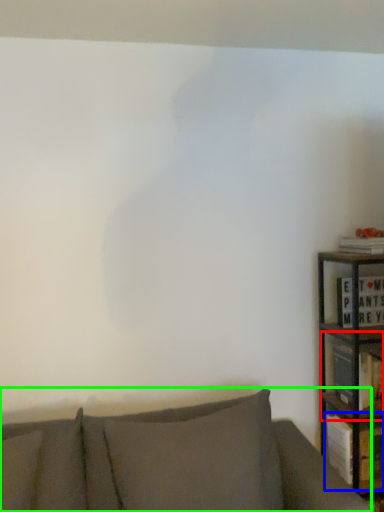
Question: Considering the real-world distances, which object is farthest from shelf (highlighted by a red box)? book (highlighted by a blue box) or studio couch (highlighted by a green box)?

Choices:
 (A) book
 (B) studio couch

Answer: (B)